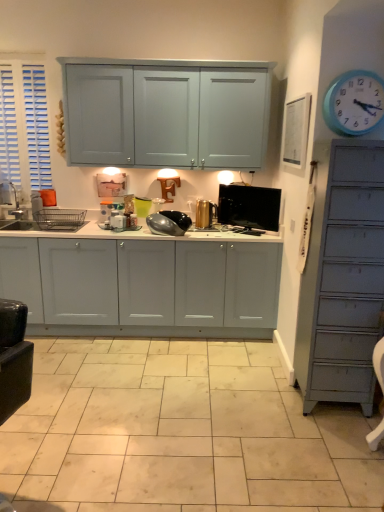
Locate an element on the screen. The image size is (384, 512). free space above white glossy tile at center (from a real-world perspective) is located at coordinates (186, 404).